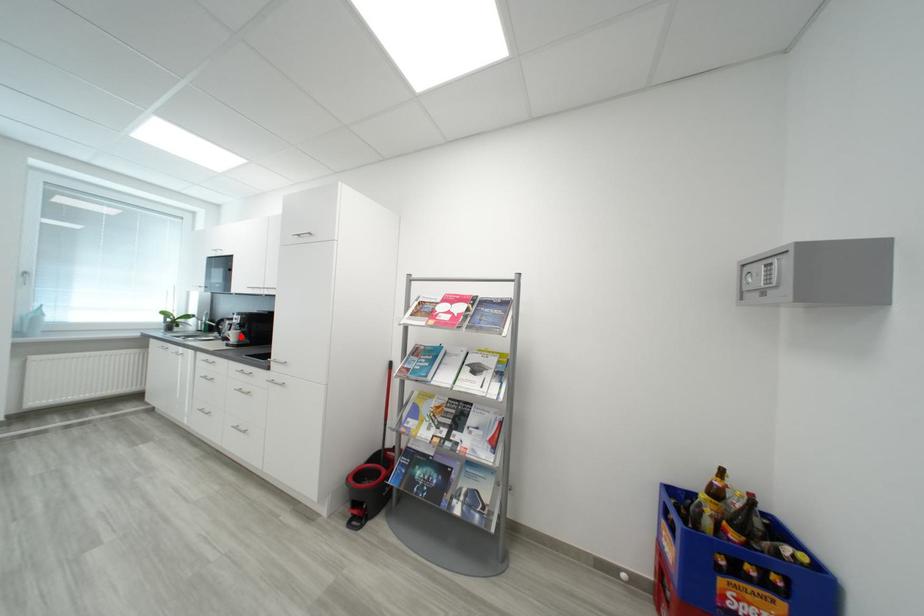
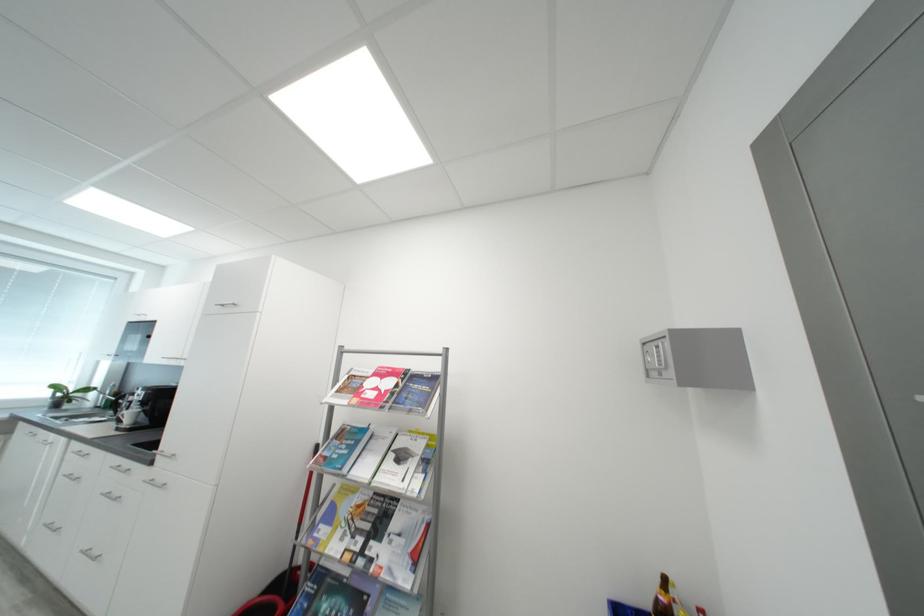
Find the pixel in the second image that matches the highlighted location in the first image.

(138, 416)